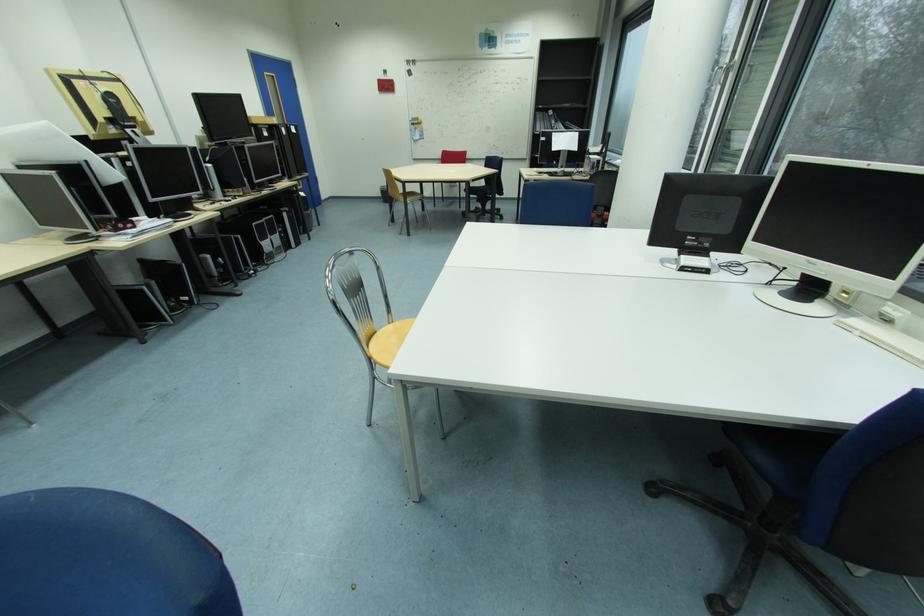
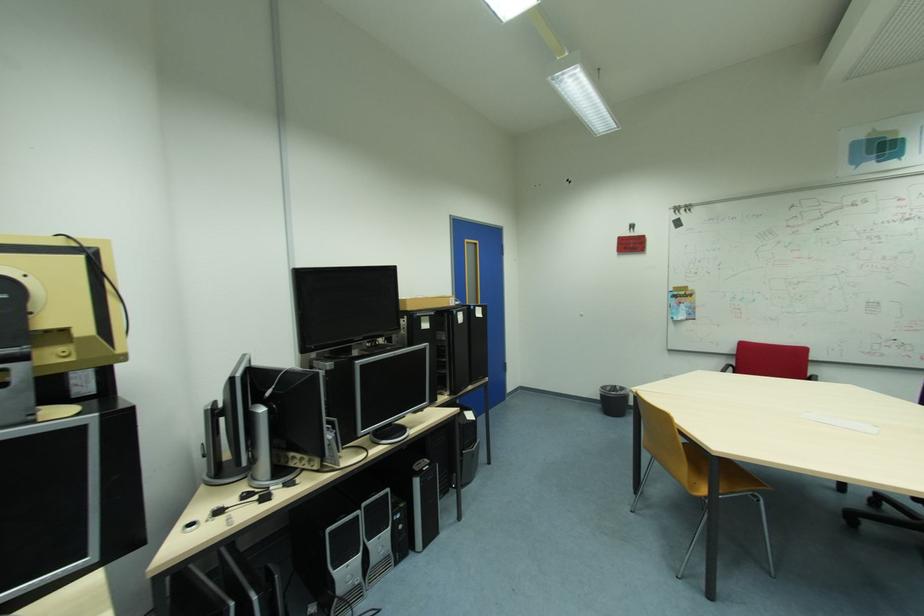
Question: I am providing you with two images of the same scene from different viewpoints. Which of the following objects are not visible in image2?

Choices:
 (A) cardboard box
 (B) blue door handle
 (C) silver computer tower
 (D) none of these

Answer: (D)